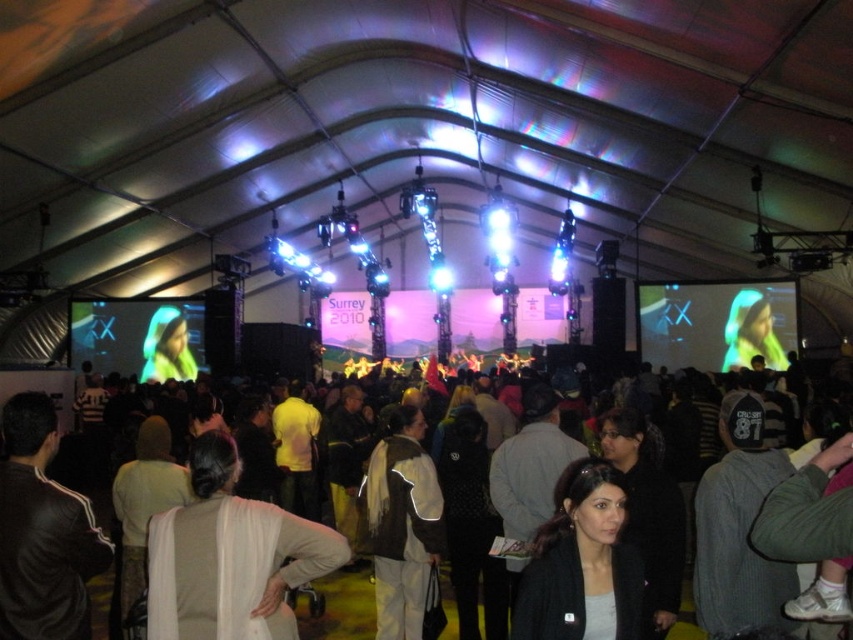
Question: Can you confirm if beige fabric jacket at center is positioned to the right of dark clothing crowd at center?

Choices:
 (A) no
 (B) yes

Answer: (B)

Question: Can you confirm if matte black jacket at lower center is thinner than dark clothing crowd at center?

Choices:
 (A) yes
 (B) no

Answer: (A)

Question: Which object is closer to the camera taking this photo?

Choices:
 (A) black mesh dress at center
 (B) beige fabric jacket at center
 (C) matte black jacket at center

Answer: (B)

Question: Can you confirm if beige fabric jacket at center is positioned below black mesh dress at center?

Choices:
 (A) no
 (B) yes

Answer: (A)

Question: Which object appears closest to the camera in this image?

Choices:
 (A) dark clothing crowd at center
 (B) matte black jacket at lower center

Answer: (A)

Question: Which of the following is the farthest from the observer?

Choices:
 (A) (560, 556)
 (B) (177, 544)
 (C) (637, 438)
 (D) (833, 497)

Answer: (C)